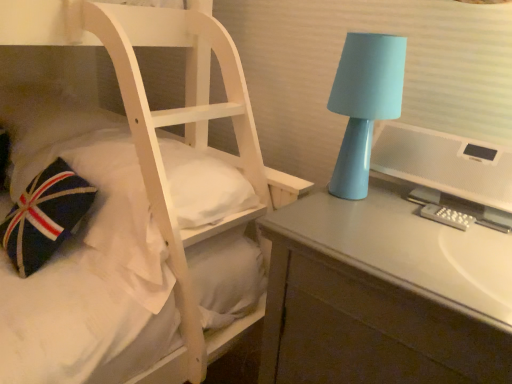
Question: Is white textured computer monitor at right to the left of matte gray desk at right from the viewer's perspective?

Choices:
 (A) yes
 (B) no

Answer: (B)

Question: Is white textured computer monitor at right outside matte gray desk at right?

Choices:
 (A) no
 (B) yes

Answer: (B)

Question: Considering the relative sizes of white textured computer monitor at right and matte gray desk at right in the image provided, is white textured computer monitor at right wider than matte gray desk at right?

Choices:
 (A) yes
 (B) no

Answer: (B)

Question: Are white textured computer monitor at right and matte gray desk at right beside each other?

Choices:
 (A) yes
 (B) no

Answer: (B)

Question: Considering the relative positions of white textured computer monitor at right and matte gray desk at right in the image provided, is white textured computer monitor at right to the right of matte gray desk at right from the viewer's perspective?

Choices:
 (A) no
 (B) yes

Answer: (B)

Question: Considering the relative sizes of white textured computer monitor at right and matte gray desk at right in the image provided, is white textured computer monitor at right bigger than matte gray desk at right?

Choices:
 (A) no
 (B) yes

Answer: (A)

Question: Is white textured computer monitor at right at the back of matte blue lamp at right?

Choices:
 (A) yes
 (B) no

Answer: (B)

Question: Considering the relative sizes of matte blue lamp at right and white textured computer monitor at right in the image provided, is matte blue lamp at right bigger than white textured computer monitor at right?

Choices:
 (A) no
 (B) yes

Answer: (B)

Question: Can you confirm if matte blue lamp at right is smaller than white textured computer monitor at right?

Choices:
 (A) yes
 (B) no

Answer: (B)

Question: Is white textured computer monitor at right inside matte blue lamp at right?

Choices:
 (A) no
 (B) yes

Answer: (A)

Question: Is the depth of matte blue lamp at right less than that of white textured computer monitor at right?

Choices:
 (A) yes
 (B) no

Answer: (B)

Question: Is matte blue lamp at right taller than white textured computer monitor at right?

Choices:
 (A) no
 (B) yes

Answer: (B)

Question: Can you confirm if matte gray desk at right is wider than matte blue lamp at right?

Choices:
 (A) no
 (B) yes

Answer: (B)